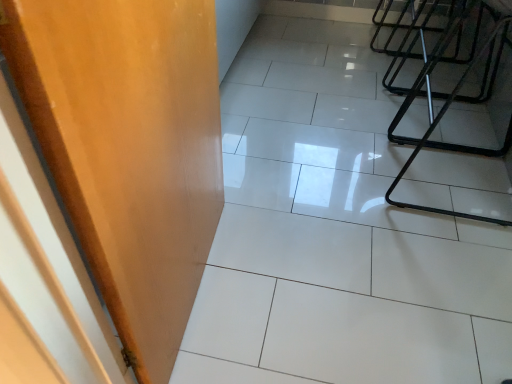
Locate an element on the screen. wooden door at left is located at coordinates (129, 148).

The image size is (512, 384). Describe the element at coordinates (129, 148) in the screenshot. I see `wooden door at left` at that location.

Locate an element on the screen. The width and height of the screenshot is (512, 384). white glossy tile at center is located at coordinates (335, 236).

Image resolution: width=512 pixels, height=384 pixels. What do you see at coordinates (335, 236) in the screenshot?
I see `white glossy tile at center` at bounding box center [335, 236].

Find the location of `wooden door at left`. wooden door at left is located at coordinates (129, 148).

Can you confirm if white glossy tile at center is positioned to the left of wooden door at left?

No.

Which is behind, white glossy tile at center or wooden door at left?

white glossy tile at center is further away from the camera.

Which is farther from the camera, [450,111] or [169,54]?

The point [450,111] is behind.

From the image's perspective, is white glossy tile at center on wooden door at left?

Yes, from the image's perspective, white glossy tile at center is over wooden door at left.

From a real-world perspective, which is physically below, white glossy tile at center or wooden door at left?

white glossy tile at center is physically lower.

Looking at this image, can you confirm if white glossy tile at center is thinner than wooden door at left?

No, white glossy tile at center is not thinner than wooden door at left.

Considering the sizes of objects white glossy tile at center and wooden door at left in the image provided, who is shorter, white glossy tile at center or wooden door at left?

white glossy tile at center is shorter.

Between white glossy tile at center and wooden door at left, which one has smaller size?

wooden door at left is smaller.

Is white glossy tile at center completely or partially outside of wooden door at left?

Absolutely, white glossy tile at center is external to wooden door at left.

Is white glossy tile at center far from wooden door at left?

Actually, white glossy tile at center and wooden door at left are a little close together.

Is white glossy tile at center positioned with its back to wooden door at left?

That's not correct — white glossy tile at center is not looking away from wooden door at left.

What's the angular difference between white glossy tile at center and wooden door at left's facing directions?

95 degrees.

How much distance is there between white glossy tile at center and wooden door at left?

23.54 inches.

You are a GUI agent. You are given a task and a screenshot of the screen. Output one action in this format:
    pyautogui.click(x=<x>, y=<y>)
    Task: Click on the ceramic tile above the wooden door at left (from the image's perspective)
    Image resolution: width=512 pixels, height=384 pixels.
    Given the screenshot: What is the action you would take?
    pyautogui.click(x=335, y=236)

Considering the relative positions of wooden door at left and white glossy tile at center in the image provided, is wooden door at left to the right of white glossy tile at center from the viewer's perspective?

Incorrect, wooden door at left is not on the right side of white glossy tile at center.

Is wooden door at left in front of or behind white glossy tile at center in the image?

Clearly, wooden door at left is in front of white glossy tile at center.

Between point (146, 132) and point (476, 269), which one is positioned behind?

The point (476, 269) is more distant.

From the image's perspective, relative to white glossy tile at center, is wooden door at left above or below?

Based on their image positions, wooden door at left is located beneath white glossy tile at center.

From a real-world perspective, which object stands above the other?

wooden door at left.

Which of these two, wooden door at left or white glossy tile at center, is wider?

Wider between the two is white glossy tile at center.

Who is taller, wooden door at left or white glossy tile at center?

Standing taller between the two is wooden door at left.

In the scene shown: Which of these two, wooden door at left or white glossy tile at center, is bigger?

Bigger between the two is white glossy tile at center.

Is wooden door at left completely or partially outside of white glossy tile at center?

wooden door at left lies outside white glossy tile at center's area.

Is wooden door at left positioned far away from white glossy tile at center?

Actually, wooden door at left and white glossy tile at center are a little close together.

In the scene shown: Is wooden door at left facing towards white glossy tile at center?

No, wooden door at left is not aimed at white glossy tile at center.

Where is `ceramic tile above the wooden door at left (from the image's perspective)`? The width and height of the screenshot is (512, 384). ceramic tile above the wooden door at left (from the image's perspective) is located at coordinates (335, 236).

In the image, there is a wooden door at left. At what (x,y) coordinates should I click in order to perform the action: click on ceramic tile above it (from the image's perspective). Please return your answer as a coordinate pair (x, y). Looking at the image, I should click on (335, 236).

Where is `ceramic tile lying behind the wooden door at left`? ceramic tile lying behind the wooden door at left is located at coordinates (335, 236).